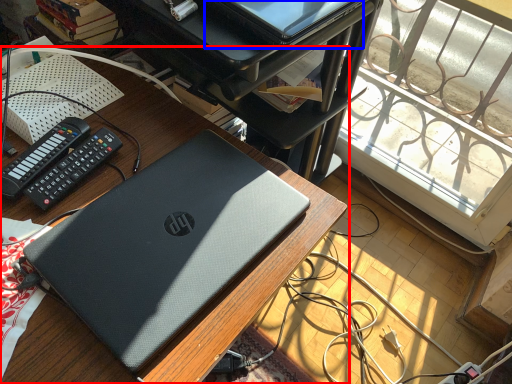
Question: Which point is closer to the camera, desk (highlighted by a red box) or computer (highlighted by a blue box)?

Choices:
 (A) desk
 (B) computer

Answer: (A)